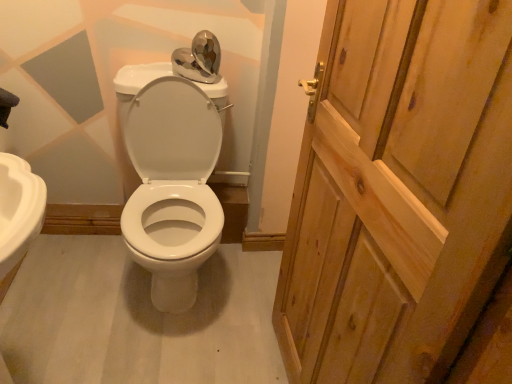
Identify the location of vacant space in front of white glossy toilet at center. The width and height of the screenshot is (512, 384). (151, 349).